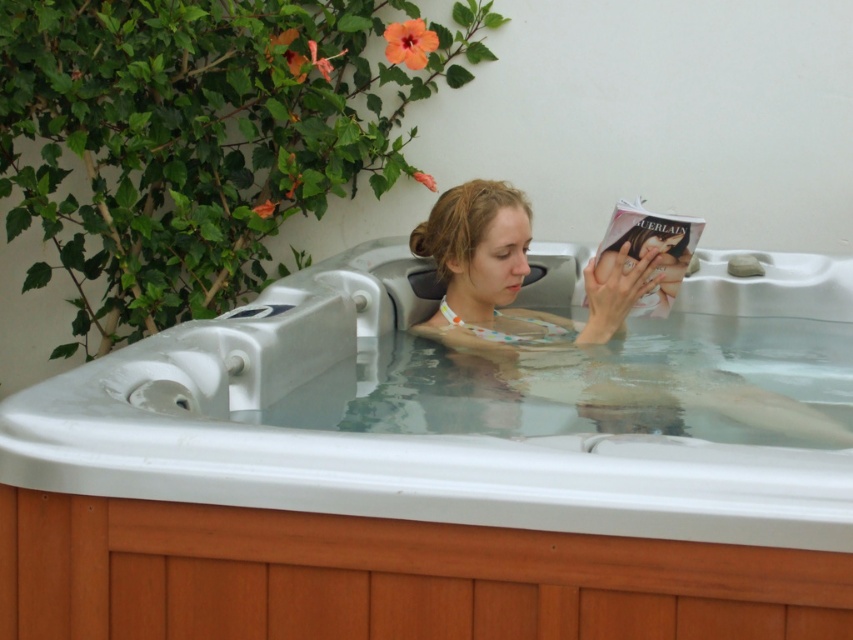
You are a photographer trying to capture a clear shot of the wooden hot tub at center without the polka dot swimsuit at center blocking it. Based on their positions, is this possible?

The wooden hot tub at center is positioned under the polka dot swimsuit at center, so the swimsuit is directly above it. This means the polka dot swimsuit at center will block the view of the wooden hot tub at center, making it impossible to capture a clear shot without the swimsuit obstructing the hot tub.

You are standing at the origin point in the coordinate system of the image. The wooden hot tub at center is located at coordinates. What are its coordinates?

The wooden hot tub at center is located at coordinates point (444, 470).

You are standing in front of the hot tub and notice two points marked on the wall behind it. The first point is at coordinate point (326, 385) and the second is at point (712, 387). Which point is closer to you?

Point (326, 385) is in front of point (712, 387), so it is closer to you.